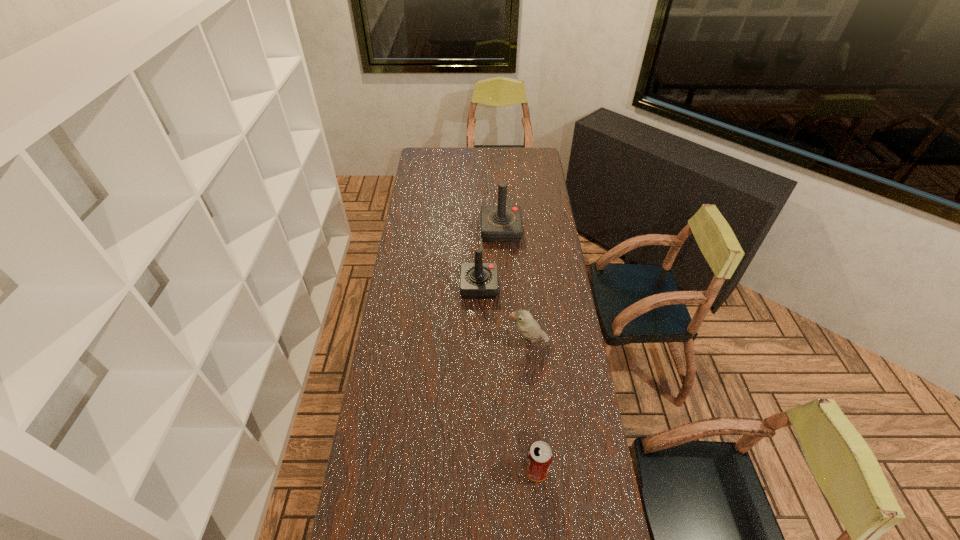
This screenshot has height=540, width=960. I want to click on the taller joystick, so click(x=501, y=223).

Locate an element on the screen. the farther joystick is located at coordinates (501, 223).

Where is `the shorter joystick`? The width and height of the screenshot is (960, 540). the shorter joystick is located at coordinates (478, 280).

You are a GUI agent. You are given a task and a screenshot of the screen. Output one action in this format:
    pyautogui.click(x=<x>, y=<y>)
    Task: Click on the nearer joystick
    The height and width of the screenshot is (540, 960).
    Given the screenshot: What is the action you would take?
    pyautogui.click(x=478, y=280)

This screenshot has height=540, width=960. I want to click on the second nearest object, so click(528, 327).

Locate an element on the screen. the nearest object is located at coordinates (539, 457).

This screenshot has width=960, height=540. Find the location of `the shortest object`. the shortest object is located at coordinates (539, 457).

At what (x,y) coordinates should I click in order to perform the action: click on vacant space situated on the rectangular base of the tallest object. Please return your answer as a coordinate pair (x, y). The height and width of the screenshot is (540, 960). Looking at the image, I should click on (467, 230).

The width and height of the screenshot is (960, 540). What are the coordinates of `vacant space situated 0.190m on the rectangular base of the tallest object` in the screenshot? It's located at (443, 230).

The image size is (960, 540). Identify the location of vacant area situated 0.290m on the rectangular base of the tallest object. (422, 230).